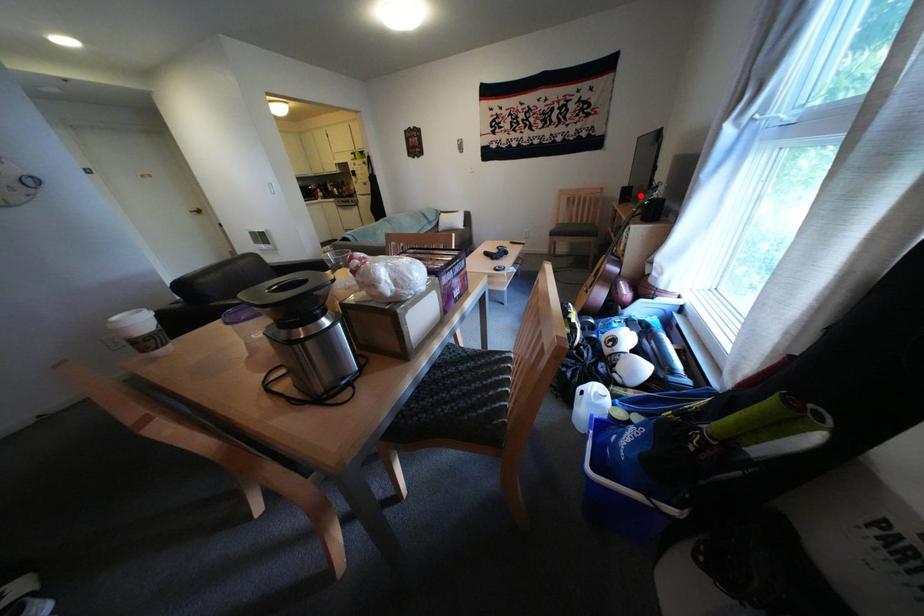
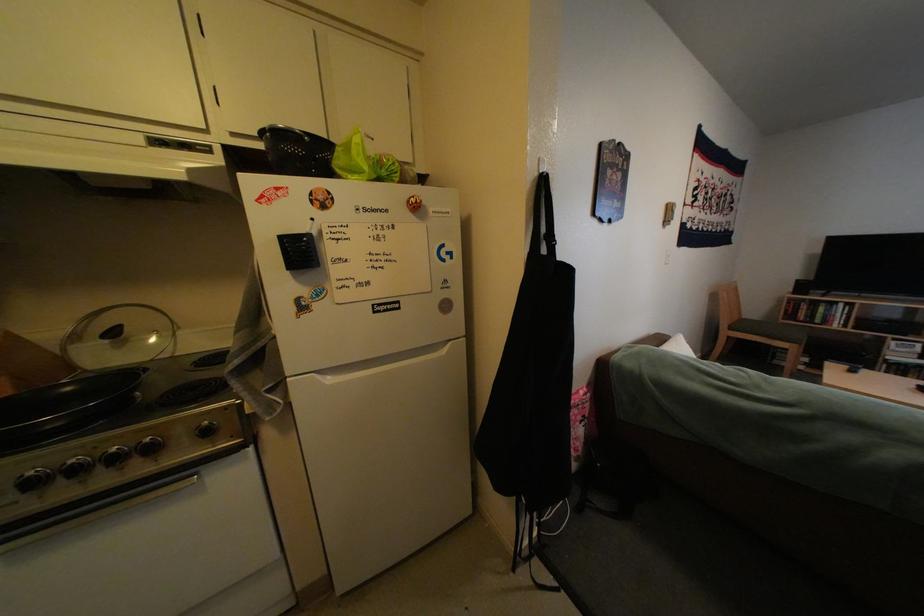
Question: I am providing you with two images of the same scene from different viewpoints. In image1, a red point is highlighted. Considering the same 3D point in image2, which of the following is correct?

Choices:
 (A) It is closer
 (B) It is farther

Answer: (B)